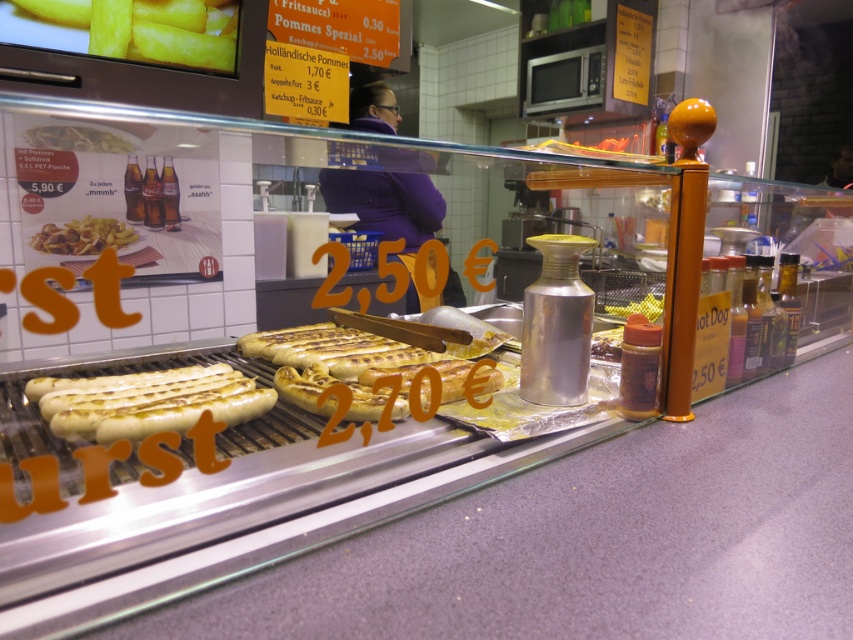
Question: Which object appears farthest from the camera in this image?

Choices:
 (A) golden crispy fries at left
 (B) yellow plastic mustard at right
 (C) matte plastic fries at left

Answer: (A)

Question: Can you confirm if yellow matte fries at upper left is positioned above matte plastic fries at left?

Choices:
 (A) yes
 (B) no

Answer: (A)

Question: Which of the following is the farthest from the observer?

Choices:
 (A) golden grilled sausage at center
 (B) yellow plastic mustard at right

Answer: (B)

Question: Can you confirm if golden crispy fries at left is positioned below matte plastic fries at left?

Choices:
 (A) no
 (B) yes

Answer: (B)

Question: Based on their relative distances, which object is nearer to the yellow plastic mustard at right?

Choices:
 (A) golden grilled sausage at center
 (B) yellow matte fries at upper left

Answer: (A)

Question: Is yellow matte fries at upper left thinner than matte plastic fries at left?

Choices:
 (A) yes
 (B) no

Answer: (A)